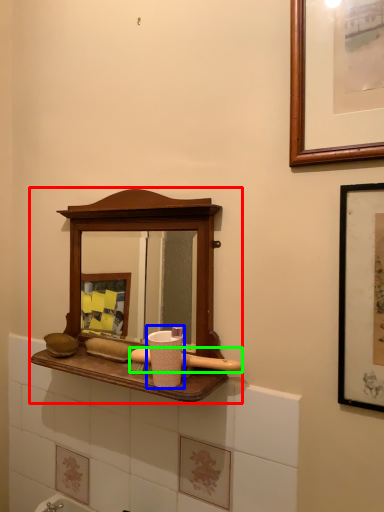
Question: Which object is positioned closest to medicine cabinet (highlighted by a red box)? Select from toiletry (highlighted by a blue box) and brush (highlighted by a green box).

Choices:
 (A) toiletry
 (B) brush

Answer: (A)